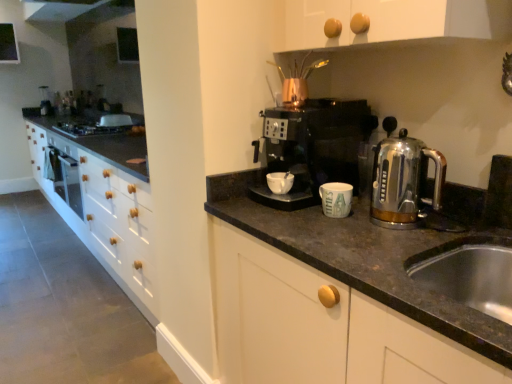
Question: Considering the relative sizes of black plastic coffee maker at center and matte ceramic mug at center in the image provided, is black plastic coffee maker at center thinner than matte ceramic mug at center?

Choices:
 (A) no
 (B) yes

Answer: (A)

Question: Does black plastic coffee maker at center lie behind matte ceramic mug at center?

Choices:
 (A) no
 (B) yes

Answer: (B)

Question: From a real-world perspective, does black plastic coffee maker at center stand above matte ceramic mug at center?

Choices:
 (A) no
 (B) yes

Answer: (B)

Question: Considering the relative positions of black plastic coffee maker at center and matte ceramic mug at center in the image provided, is black plastic coffee maker at center in front of matte ceramic mug at center?

Choices:
 (A) no
 (B) yes

Answer: (A)

Question: Is matte ceramic mug at center at the back of black plastic coffee maker at center?

Choices:
 (A) yes
 (B) no

Answer: (B)

Question: Is white matte mug at center bigger or smaller than matte ceramic mug at center?

Choices:
 (A) small
 (B) big

Answer: (A)

Question: Is white matte mug at center taller or shorter than matte ceramic mug at center?

Choices:
 (A) short
 (B) tall

Answer: (A)

Question: Considering the positions of point pos(270,173) and point pos(338,193), is point pos(270,173) closer or farther from the camera than point pos(338,193)?

Choices:
 (A) farther
 (B) closer

Answer: (A)

Question: In the image, is white matte mug at center positioned in front of or behind matte ceramic mug at center?

Choices:
 (A) front
 (B) behind

Answer: (B)

Question: Considering the positions of point (434, 185) and point (285, 175), is point (434, 185) closer or farther from the camera than point (285, 175)?

Choices:
 (A) closer
 (B) farther

Answer: (A)

Question: Is satin chrome kettle at right in front of or behind white matte mug at center in the image?

Choices:
 (A) behind
 (B) front

Answer: (B)

Question: From their relative heights in the image, would you say satin chrome kettle at right is taller or shorter than white matte mug at center?

Choices:
 (A) short
 (B) tall

Answer: (B)

Question: From the image's perspective, is satin chrome kettle at right positioned above or below white matte mug at center?

Choices:
 (A) above
 (B) below

Answer: (A)

Question: From the image's perspective, is white matte mug at center located above or below satin chrome kettle at right?

Choices:
 (A) below
 (B) above

Answer: (A)

Question: Is point (279, 183) closer or farther from the camera than point (401, 218)?

Choices:
 (A) farther
 (B) closer

Answer: (A)